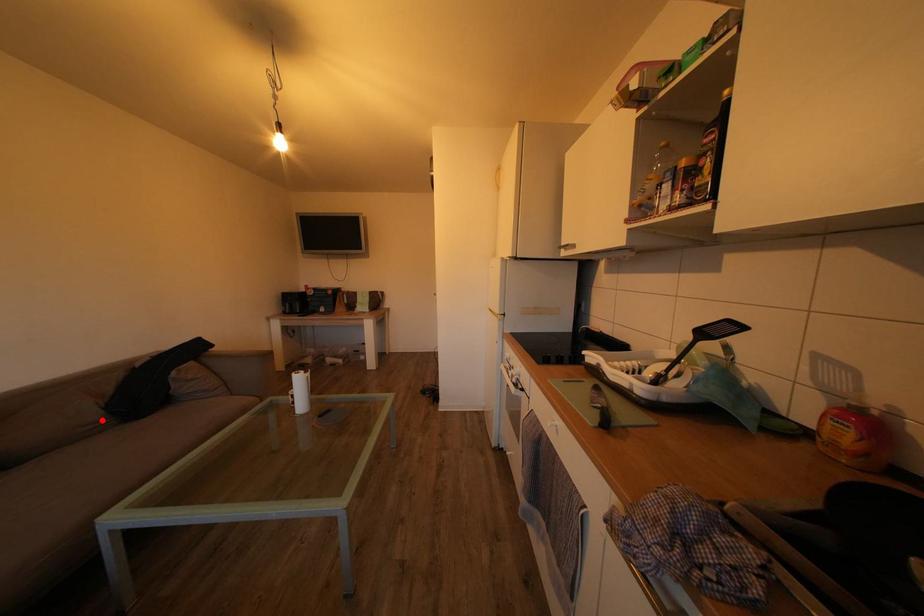
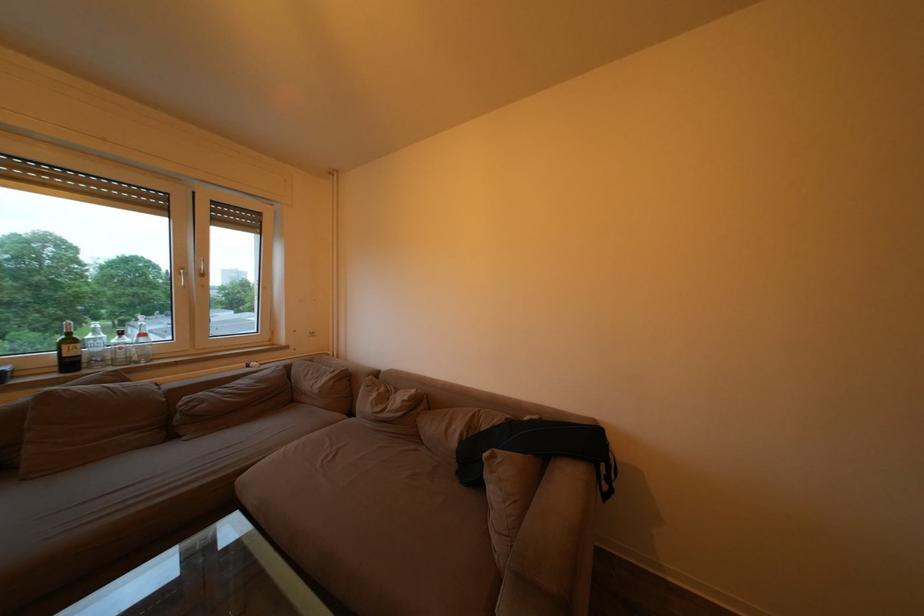
Question: I am providing you with two images of the same scene from different viewpoints. Image1 has a red point marked. In image2, the corresponding 3D location appears at what relative position? Reply with the corresponding letter.

Choices:
 (A) Closer
 (B) Farther

Answer: (B)